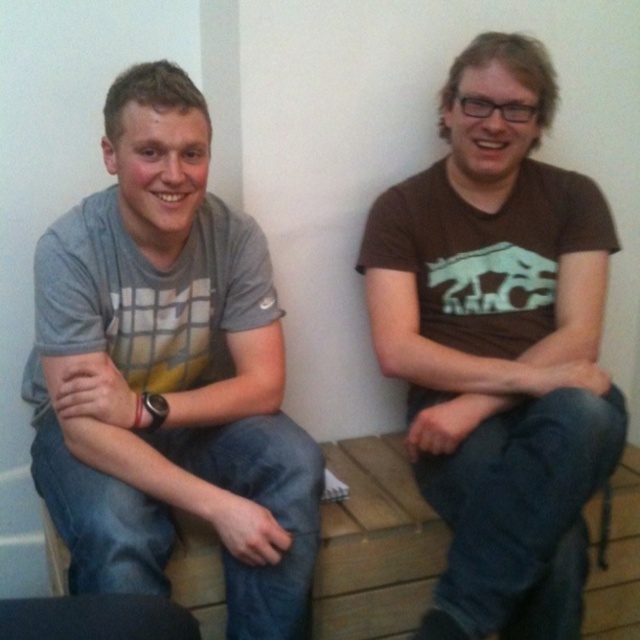
Who is positioned more to the left, gray cotton t-shirt at left or brown matte t-shirt at center?

Positioned to the left is gray cotton t-shirt at left.

Can you confirm if gray cotton t-shirt at left is smaller than brown matte t-shirt at center?

Correct, gray cotton t-shirt at left occupies less space than brown matte t-shirt at center.

Image resolution: width=640 pixels, height=640 pixels. In order to click on gray cotton t-shirt at left in this screenshot , I will do `click(168, 372)`.

At what (x,y) coordinates should I click in order to perform the action: click on gray cotton t-shirt at left. Please return your answer as a coordinate pair (x, y). The width and height of the screenshot is (640, 640). Looking at the image, I should click on (168, 372).

How distant is gray cotton t-shirt at left from black matte laptop at lower left?

gray cotton t-shirt at left and black matte laptop at lower left are 15.12 inches apart from each other.

Is point (115, 522) more distant than point (19, 600)?

That is True.

Where is `gray cotton t-shirt at left`? The image size is (640, 640). gray cotton t-shirt at left is located at coordinates [168, 372].

Looking at this image, can you confirm if brown matte t-shirt at center is wider than black matte laptop at lower left?

Yes.

Between brown matte t-shirt at center and black matte laptop at lower left, which one has more height?

With more height is brown matte t-shirt at center.

I want to click on brown matte t-shirt at center, so click(499, 346).